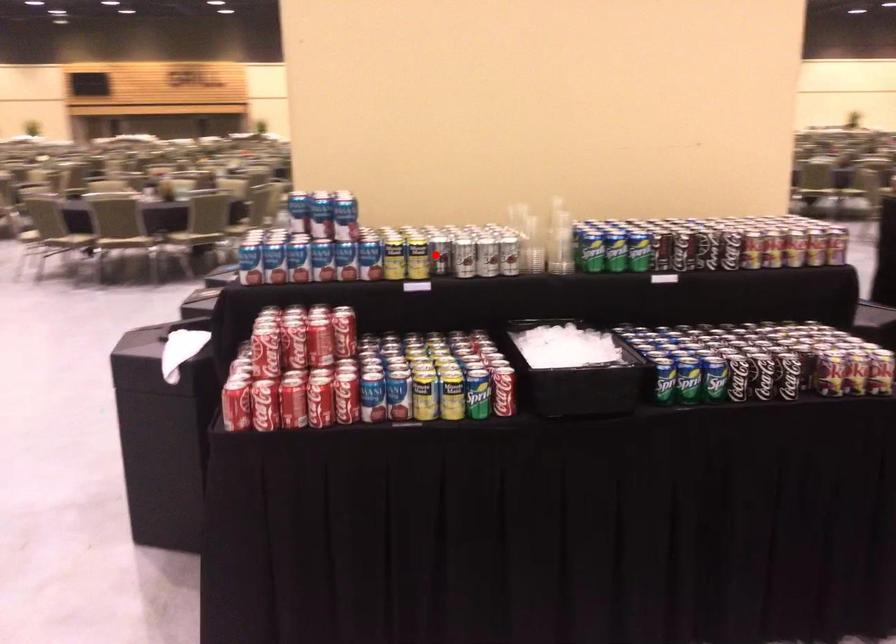
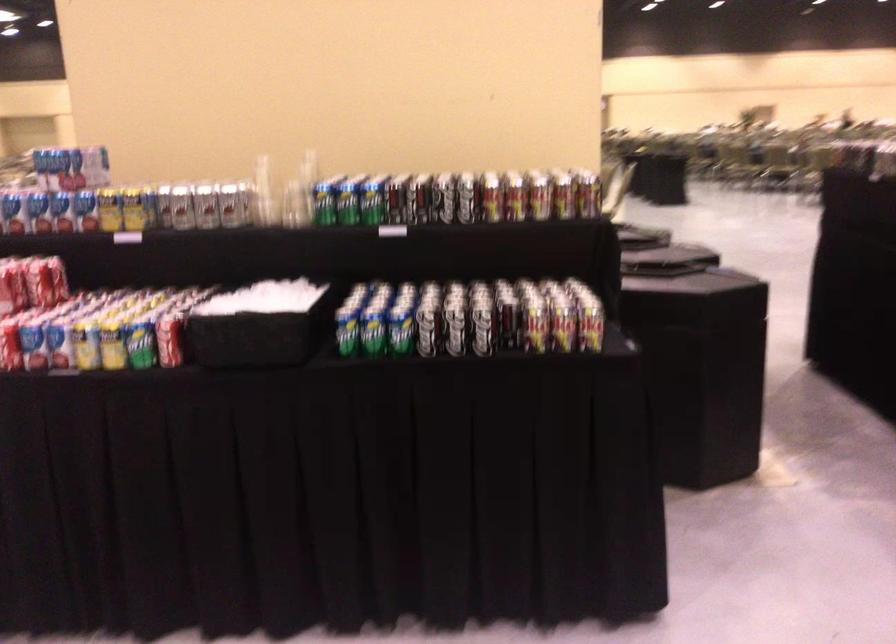
Locate, in the second image, the point that corresponds to the highlighted location in the first image.

(162, 205)